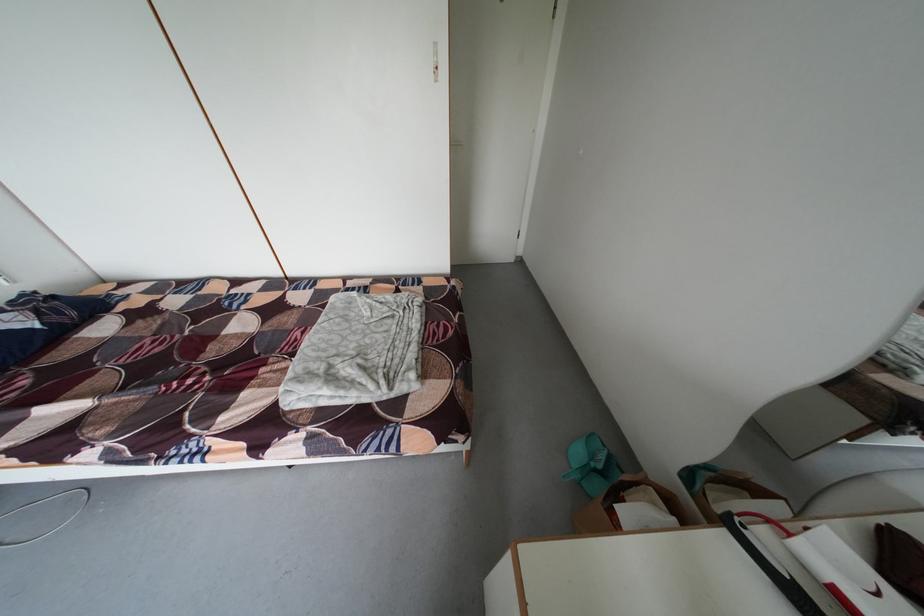
The height and width of the screenshot is (616, 924). What do you see at coordinates (591, 464) in the screenshot?
I see `the green dustpan handle` at bounding box center [591, 464].